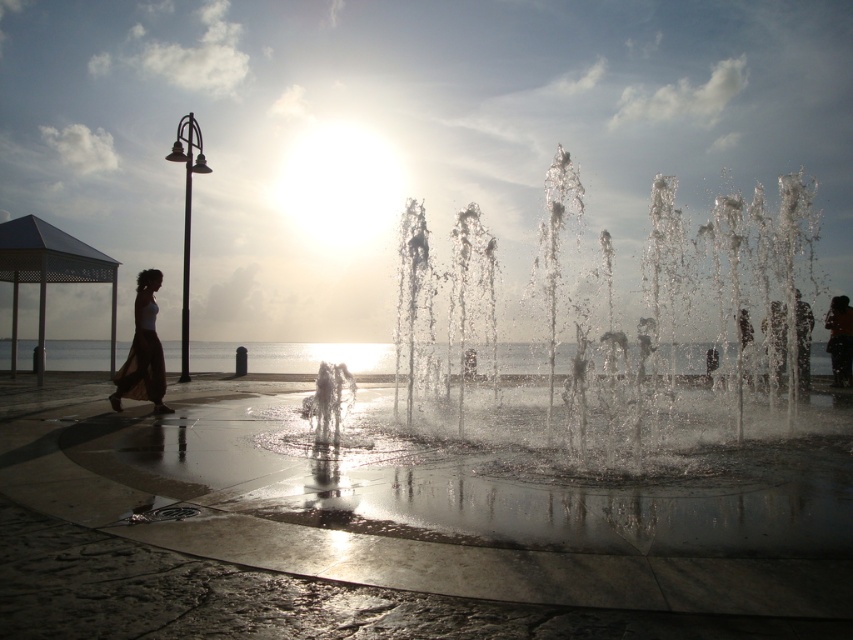
Between clear water at center and silhouette skirt at left, which one is positioned lower?

clear water at center is below.

Does point (264, 364) come behind point (154, 269)?

That is True.

What do you see at coordinates (318, 356) in the screenshot? I see `clear water at center` at bounding box center [318, 356].

I want to click on clear water at center, so click(x=318, y=356).